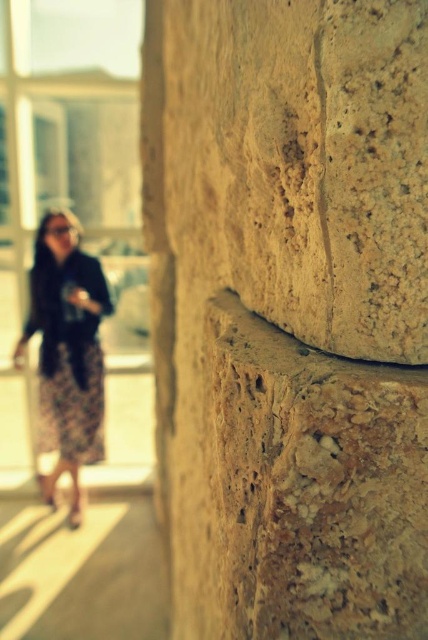
You are standing in front of the natural stone wall at right and the floral skirt at left. Which object is positioned to the right side of the other?

The natural stone wall at right is to the right of the floral skirt at left.

You are standing in front of a stone wall and a person wearing a floral skirt. The natural stone wall at right and the floral skirt at left are both in your view. Which object takes up more space in the image?

The natural stone wall at right has a larger size compared to the floral skirt at left, so it takes up more space in the image.